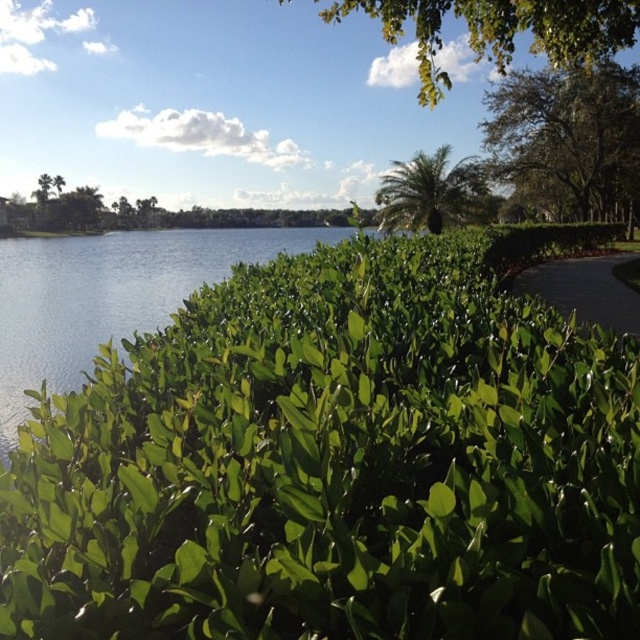
Can you confirm if green leafy tree at upper right is positioned below green leafy palm at upper right?

No.

Looking at this image, which is above, green leafy tree at upper right or green leafy palm at upper right?

green leafy tree at upper right

Locate an element on the screen. green leafy tree at upper right is located at coordinates (566, 138).

Where is `green leafy tree at upper right`? The width and height of the screenshot is (640, 640). green leafy tree at upper right is located at coordinates (566, 138).

Who is positioned more to the right, green leafy bush at lower left or green leafy tree at upper right?

Positioned to the right is green leafy tree at upper right.

Who is positioned more to the left, green leafy bush at lower left or green leafy tree at upper right?

green leafy bush at lower left is more to the left.

Locate an element on the screen. green leafy bush at lower left is located at coordinates (108, 296).

The width and height of the screenshot is (640, 640). In order to click on green leafy bush at lower left in this screenshot , I will do `click(108, 296)`.

Where is `green leafy bush at lower left`? The image size is (640, 640). green leafy bush at lower left is located at coordinates (108, 296).